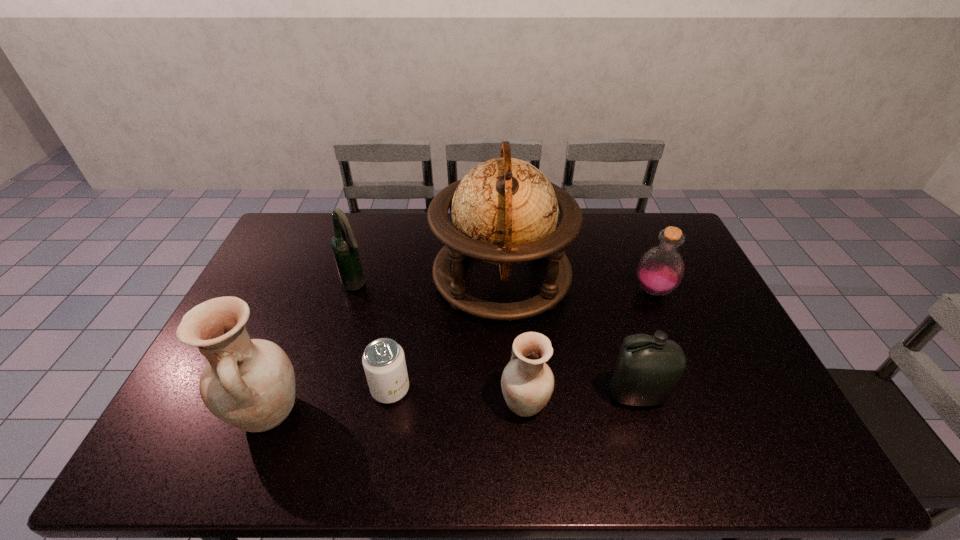
Locate an element on the screen. This screenshot has height=540, width=960. object that is positioned at the left edge is located at coordinates (249, 384).

This screenshot has width=960, height=540. Identify the location of object that is positioned at the right edge. (660, 270).

The width and height of the screenshot is (960, 540). Find the location of `object located in the near left corner section of the desktop`. object located in the near left corner section of the desktop is located at coordinates (249, 384).

Where is `free point at the far edge`? This screenshot has width=960, height=540. free point at the far edge is located at coordinates (403, 240).

Where is `free space at the near edge of the desktop`? Image resolution: width=960 pixels, height=540 pixels. free space at the near edge of the desktop is located at coordinates (422, 397).

This screenshot has height=540, width=960. What are the coordinates of `free space at the left edge of the desktop` in the screenshot? It's located at (284, 316).

The height and width of the screenshot is (540, 960). I want to click on free space at the right edge of the desktop, so click(710, 349).

In the image, there is a desktop. Where is `vacant space at the far left corner`? The height and width of the screenshot is (540, 960). vacant space at the far left corner is located at coordinates (311, 220).

The height and width of the screenshot is (540, 960). Find the location of `blank region between the left bottle and the globe`. blank region between the left bottle and the globe is located at coordinates (569, 336).

Image resolution: width=960 pixels, height=540 pixels. Identify the location of vacant space that's between the tallest object and the third tallest object. click(x=429, y=281).